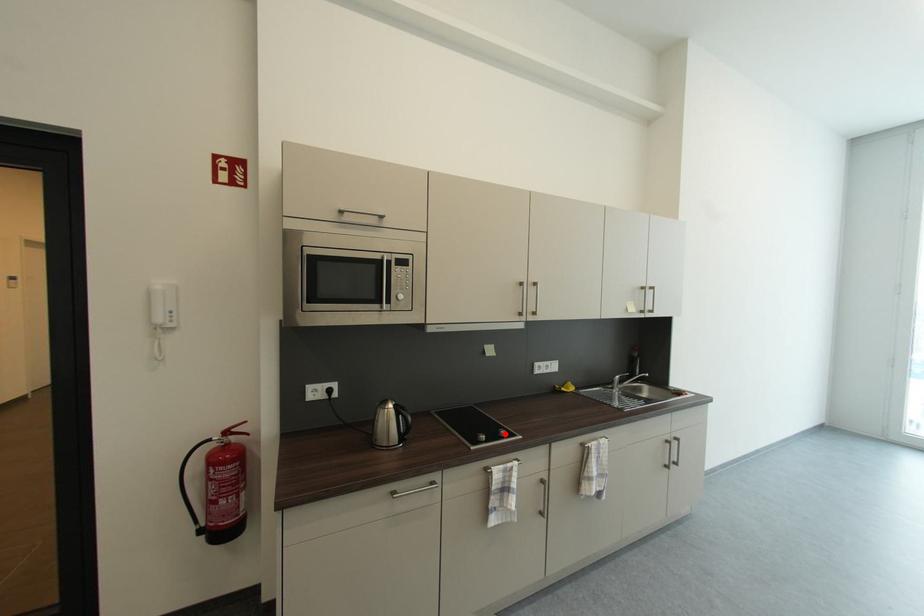
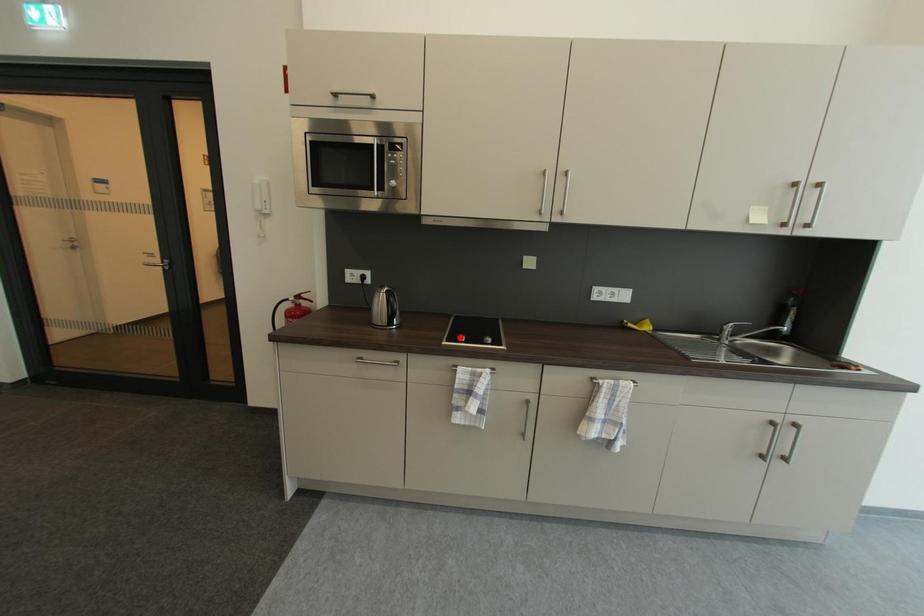
I am providing you with two images of the same scene from different viewpoints. A red point is marked on the first image and another point is marked on the second image. Are the points marked in image1 and image2 representing the same 3D position?

No